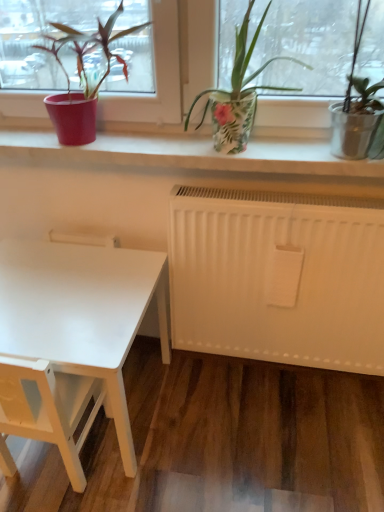
Question: From the image's perspective, is floral-patterned pot at center, the first houseplant in the right-to-left sequence, beneath white matte table at lower left?

Choices:
 (A) yes
 (B) no

Answer: (B)

Question: Is floral-patterned pot at center, acting as the 2th houseplant starting from the left, outside white matte table at lower left?

Choices:
 (A) yes
 (B) no

Answer: (A)

Question: Could white matte table at lower left be considered to be inside floral-patterned pot at center, acting as the 2th houseplant starting from the left?

Choices:
 (A) yes
 (B) no

Answer: (B)

Question: Is floral-patterned pot at center, the first houseplant in the right-to-left sequence, at the right side of white matte table at lower left?

Choices:
 (A) no
 (B) yes

Answer: (B)

Question: Is floral-patterned pot at center, acting as the 2th houseplant starting from the left, placed right next to white matte table at lower left?

Choices:
 (A) yes
 (B) no

Answer: (B)

Question: From the image's perspective, is white matte table at lower left positioned above or below floral-patterned pot at center, the first houseplant in the right-to-left sequence?

Choices:
 (A) above
 (B) below

Answer: (B)

Question: Considering the positions of white matte table at lower left and floral-patterned pot at center, acting as the 2th houseplant starting from the left, in the image, is white matte table at lower left taller or shorter than floral-patterned pot at center, acting as the 2th houseplant starting from the left,?

Choices:
 (A) short
 (B) tall

Answer: (B)

Question: Is white matte table at lower left bigger or smaller than floral-patterned pot at center, the first houseplant in the right-to-left sequence?

Choices:
 (A) small
 (B) big

Answer: (B)

Question: Is point pyautogui.click(x=21, y=312) positioned closer to the camera than point pyautogui.click(x=223, y=98)?

Choices:
 (A) farther
 (B) closer

Answer: (A)

Question: In the image, is floral-patterned pot at center, the first houseplant in the right-to-left sequence, positioned in front of or behind matte red pot at left, arranged as the 1th houseplant when viewed from the left?

Choices:
 (A) front
 (B) behind

Answer: (A)

Question: Considering the positions of floral-patterned pot at center, acting as the 2th houseplant starting from the left, and matte red pot at left, arranged as the 1th houseplant when viewed from the left, in the image, is floral-patterned pot at center, acting as the 2th houseplant starting from the left, wider or thinner than matte red pot at left, arranged as the 1th houseplant when viewed from the left,?

Choices:
 (A) wide
 (B) thin

Answer: (A)

Question: Is point (226, 140) positioned closer to the camera than point (66, 121)?

Choices:
 (A) farther
 (B) closer

Answer: (B)

Question: From a real-world perspective, is floral-patterned pot at center, acting as the 2th houseplant starting from the left, above or below matte red pot at left, arranged as the 1th houseplant when viewed from the left?

Choices:
 (A) below
 (B) above

Answer: (A)

Question: Considering the positions of white matte table at lower left and matte red pot at left, which is counted as the second houseplant, starting from the right, in the image, is white matte table at lower left taller or shorter than matte red pot at left, which is counted as the second houseplant, starting from the right,?

Choices:
 (A) short
 (B) tall

Answer: (B)

Question: From a real-world perspective, is white matte table at lower left positioned above or below matte red pot at left, arranged as the 1th houseplant when viewed from the left?

Choices:
 (A) above
 (B) below

Answer: (B)